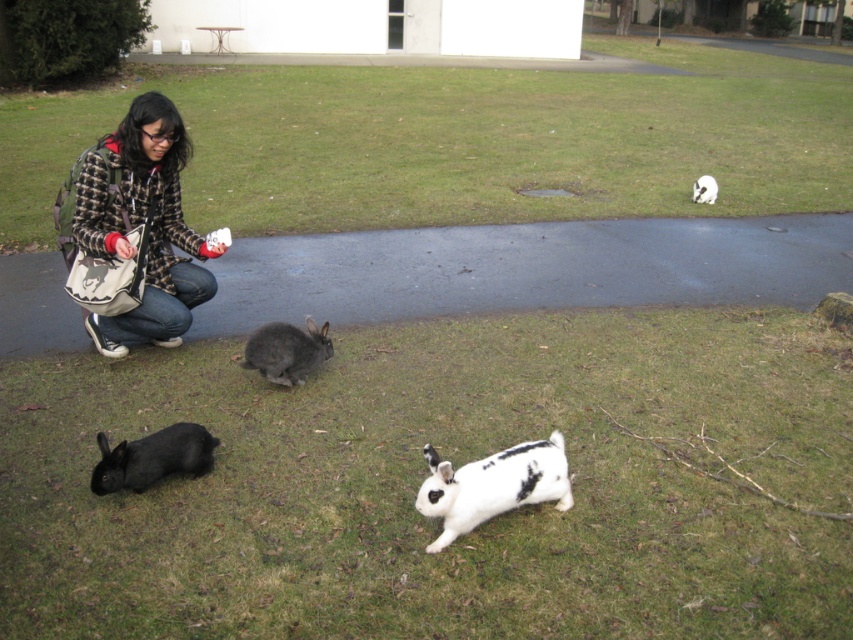
Does plaid wool jacket at left have a smaller size compared to white soft fur rabbit at center?

Actually, plaid wool jacket at left might be larger than white soft fur rabbit at center.

Is the position of plaid wool jacket at left less distant than that of white soft fur rabbit at center?

Yes.

Measure the distance between point (157,205) and camera.

The distance of point (157,205) from camera is 4.60 meters.

The image size is (853, 640). In order to click on plaid wool jacket at left in this screenshot , I will do `click(138, 232)`.

Describe the element at coordinates (457, 141) in the screenshot. The image size is (853, 640). I see `green grass at upper center` at that location.

Is point (790, 77) positioned behind point (144, 480)?

Yes, it is behind point (144, 480).

Where is `green grass at upper center`? green grass at upper center is located at coordinates (457, 141).

Which is behind, point (305, 336) or point (708, 182)?

Positioned behind is point (708, 182).

Which is in front, point (277, 339) or point (695, 195)?

Point (277, 339) is more forward.

Which is in front, point (291, 385) or point (699, 189)?

Positioned in front is point (291, 385).

At what (x,y) coordinates should I click in order to perform the action: click on dark gray fur rabbit at center. Please return your answer as a coordinate pair (x, y). Looking at the image, I should click on (286, 349).